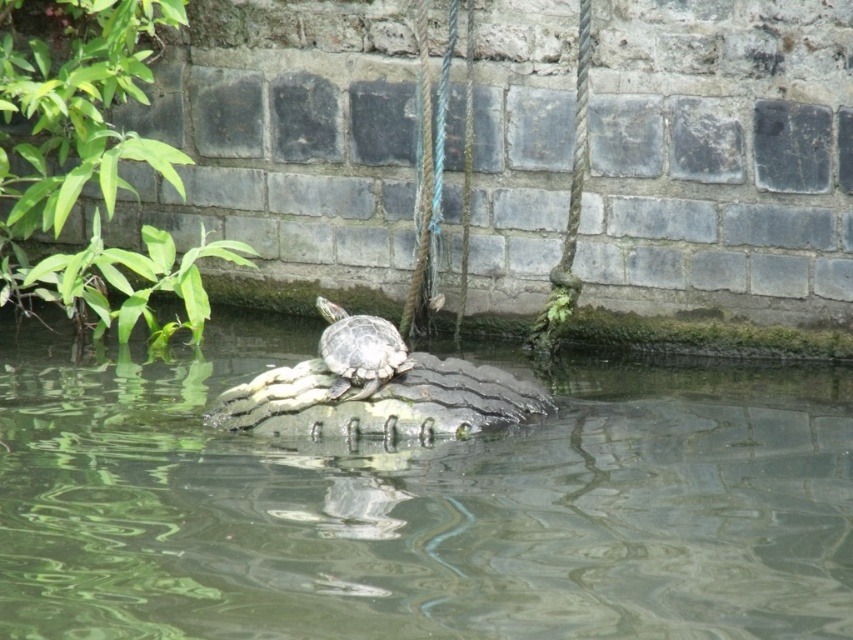
Does greenish water at center have a greater width compared to smooth green tortoise at center?

Yes.

What are the coordinates of `greenish water at center` in the screenshot? It's located at (419, 504).

Find the location of `greenish water at center`. greenish water at center is located at coordinates (419, 504).